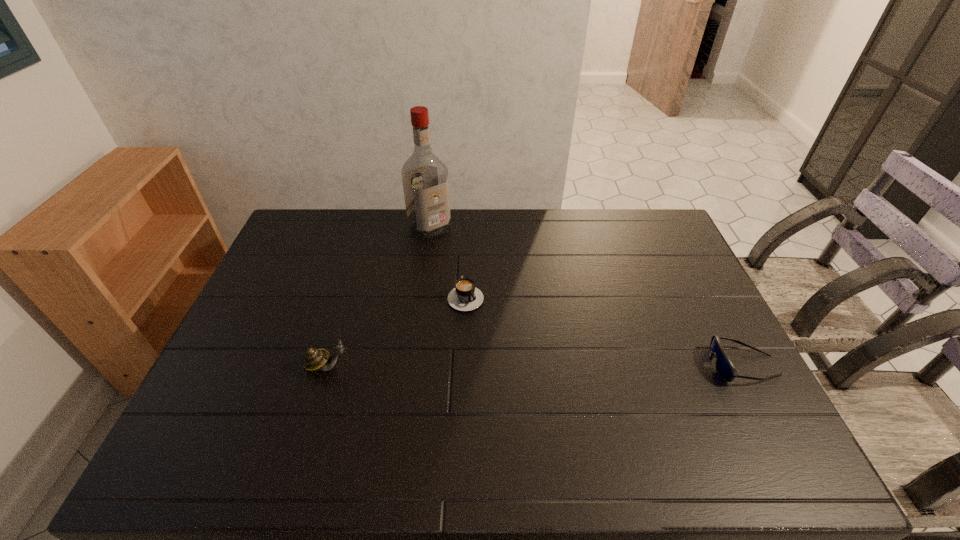
I want to click on free space located 0.240m on the front-facing side of the sunglasses, so (619, 365).

Identify the location of vacant space located 0.230m with the handle on the side of the cappuccino. (523, 361).

Image resolution: width=960 pixels, height=540 pixels. Find the location of `vacant space located with the handle on the side of the cappuccino`. vacant space located with the handle on the side of the cappuccino is located at coordinates (552, 394).

Where is `free spot located with the handle on the side of the cappuccino`? The image size is (960, 540). free spot located with the handle on the side of the cappuccino is located at coordinates (514, 351).

The height and width of the screenshot is (540, 960). Find the location of `free region located 0.350m on the front-facing side of the liquor`. free region located 0.350m on the front-facing side of the liquor is located at coordinates (497, 297).

Locate an element on the screen. This screenshot has width=960, height=540. vacant space located on the front-facing side of the liquor is located at coordinates (463, 262).

The image size is (960, 540). Find the location of `vacant space located 0.380m on the front-facing side of the liquor`. vacant space located 0.380m on the front-facing side of the liquor is located at coordinates (503, 303).

You are a GUI agent. You are given a task and a screenshot of the screen. Output one action in this format:
    pyautogui.click(x=<x>, y=<y>)
    Task: Click on the object located in the far edge section of the desktop
    
    Given the screenshot: What is the action you would take?
    pyautogui.click(x=425, y=179)

Where is `object that is at the right edge`? The height and width of the screenshot is (540, 960). object that is at the right edge is located at coordinates (724, 367).

Locate an element on the screen. vacant space at the far edge of the desktop is located at coordinates (348, 247).